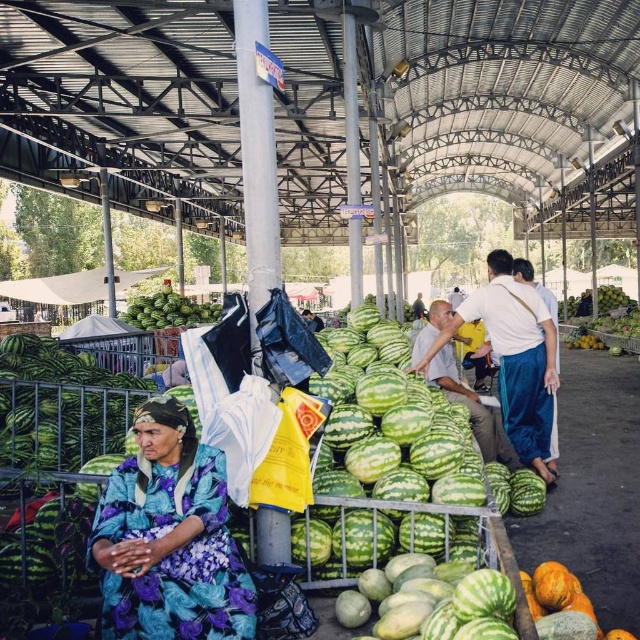
Question: Does smooth white shirt at center have a larger size compared to green matte watermelon at center?

Choices:
 (A) no
 (B) yes

Answer: (A)

Question: Which of the following is the closest to the observer?

Choices:
 (A) smooth white shirt at center
 (B) floral fabric dress at lower left

Answer: (B)

Question: Considering the real-world distances, which object is closest to the green matte watermelon at center?

Choices:
 (A) floral fabric dress at lower left
 (B) smooth white shirt at center

Answer: (B)

Question: Does smooth white shirt at center appear over green matte watermelon at center?

Choices:
 (A) no
 (B) yes

Answer: (A)

Question: Which object appears farthest from the camera in this image?

Choices:
 (A) green matte watermelon at center
 (B) floral fabric dress at lower left
 (C) smooth white shirt at center

Answer: (A)

Question: From the image, what is the correct spatial relationship of smooth white shirt at center in relation to green matte watermelon at center?

Choices:
 (A) left
 (B) right

Answer: (B)